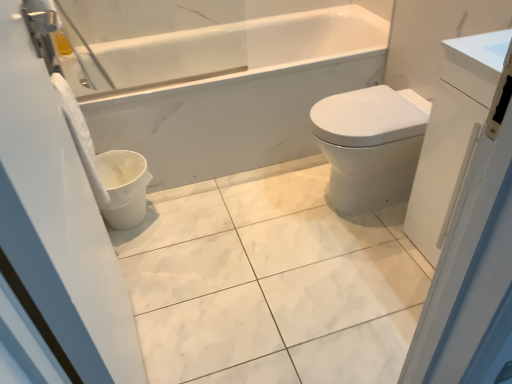
Find the location of a particular element. The height and width of the screenshot is (384, 512). vacant space behind white glossy screen door at left, which ranks as the first screen door in left-to-right order is located at coordinates (187, 275).